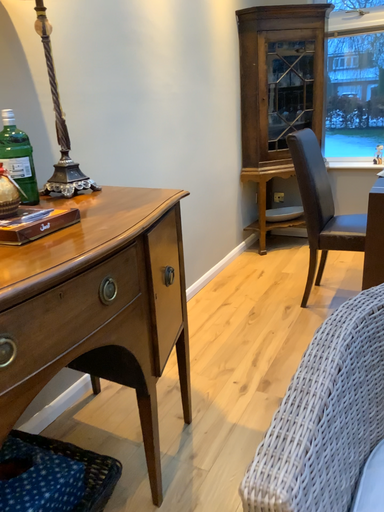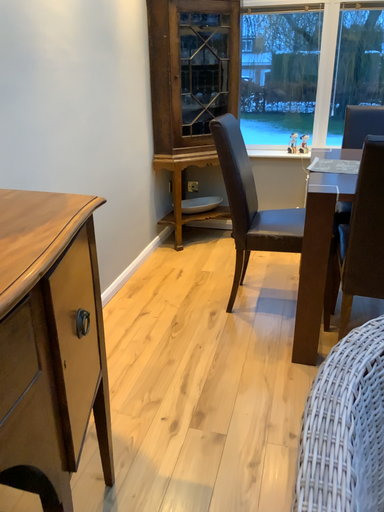
Question: How did the camera likely rotate when shooting the video?

Choices:
 (A) rotated left
 (B) rotated right

Answer: (B)